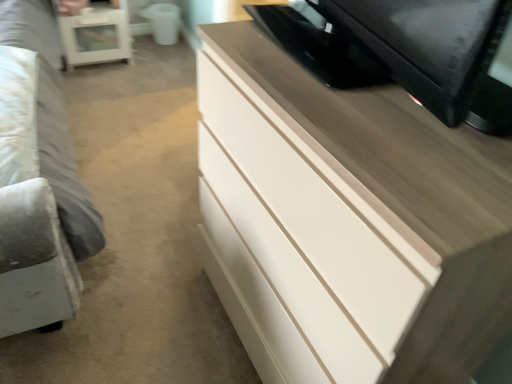
Question: Considering the relative positions of white glossy chest of drawers at upper right and white glossy side table at upper left in the image provided, is white glossy chest of drawers at upper right to the left of white glossy side table at upper left from the viewer's perspective?

Choices:
 (A) no
 (B) yes

Answer: (A)

Question: From the image's perspective, is white glossy chest of drawers at upper right beneath white glossy side table at upper left?

Choices:
 (A) no
 (B) yes

Answer: (B)

Question: Is white glossy chest of drawers at upper right to the right of white glossy side table at upper left from the viewer's perspective?

Choices:
 (A) yes
 (B) no

Answer: (A)

Question: Is white glossy chest of drawers at upper right positioned in front of white glossy side table at upper left?

Choices:
 (A) yes
 (B) no

Answer: (A)

Question: Can you confirm if white glossy chest of drawers at upper right is shorter than white glossy side table at upper left?

Choices:
 (A) no
 (B) yes

Answer: (A)

Question: From a real-world perspective, is white glossy chest of drawers at upper right positioned under white glossy side table at upper left based on gravity?

Choices:
 (A) yes
 (B) no

Answer: (B)

Question: Does white glossy side table at upper left have a greater width compared to white glossy chest of drawers at upper right?

Choices:
 (A) yes
 (B) no

Answer: (B)

Question: Considering the relative positions of white glossy side table at upper left and white glossy chest of drawers at upper right in the image provided, is white glossy side table at upper left behind white glossy chest of drawers at upper right?

Choices:
 (A) yes
 (B) no

Answer: (A)

Question: Does white glossy side table at upper left have a smaller size compared to white glossy chest of drawers at upper right?

Choices:
 (A) yes
 (B) no

Answer: (A)

Question: Is white glossy side table at upper left located outside white glossy chest of drawers at upper right?

Choices:
 (A) yes
 (B) no

Answer: (A)

Question: From the image's perspective, is white glossy side table at upper left below white glossy chest of drawers at upper right?

Choices:
 (A) no
 (B) yes

Answer: (A)

Question: Does white glossy side table at upper left have a greater height compared to white glossy chest of drawers at upper right?

Choices:
 (A) yes
 (B) no

Answer: (B)

Question: From a real-world perspective, is white glossy side table at upper left above or below white glossy chest of drawers at upper right?

Choices:
 (A) above
 (B) below

Answer: (B)